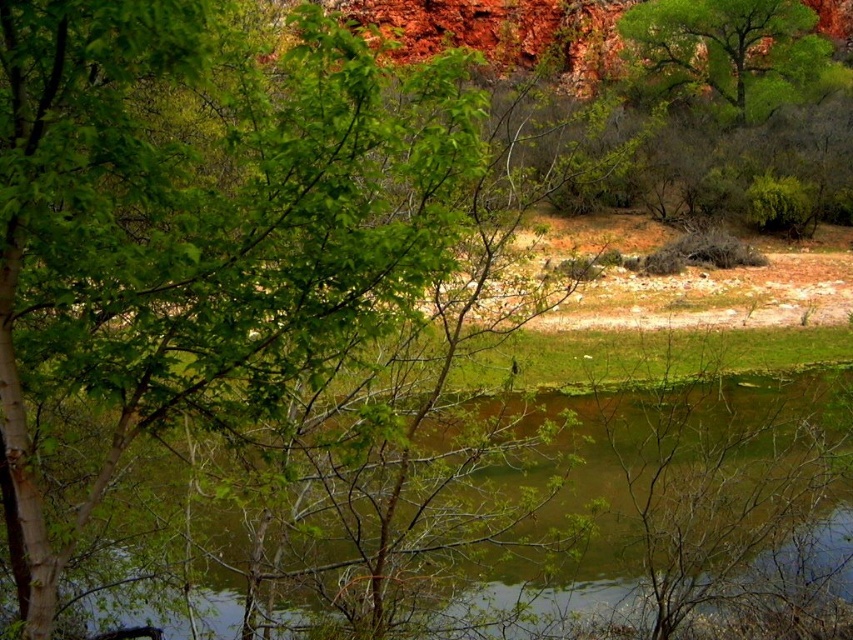
You are standing at the point labeled point (393,512) and want to move to point (781,17). Considering the terrain described, which direction should you move to reach your destination?

Since point (393,512) is closer to the camera than point (781,17), you should move towards the background of the image to reach point (781,17).

You are standing in the natural landscape and want to walk from the dry, earthy terrain in the midground to the green leafy tree at upper right. Which direction should you head to avoid the green murky water at center?

To avoid the green murky water at center, you should head to the right of the green leafy tree at upper right since the green murky water at center is located to the left of the green leafy tree at upper right.

You are standing in the natural landscape and want to take a photo of the green leafy tree at upper right without the green murky water at center appearing in the frame. How should you adjust your camera angle?

To avoid capturing the green murky water at center, you should aim your camera upwards towards the green leafy tree at upper right, as the water is positioned below the tree.